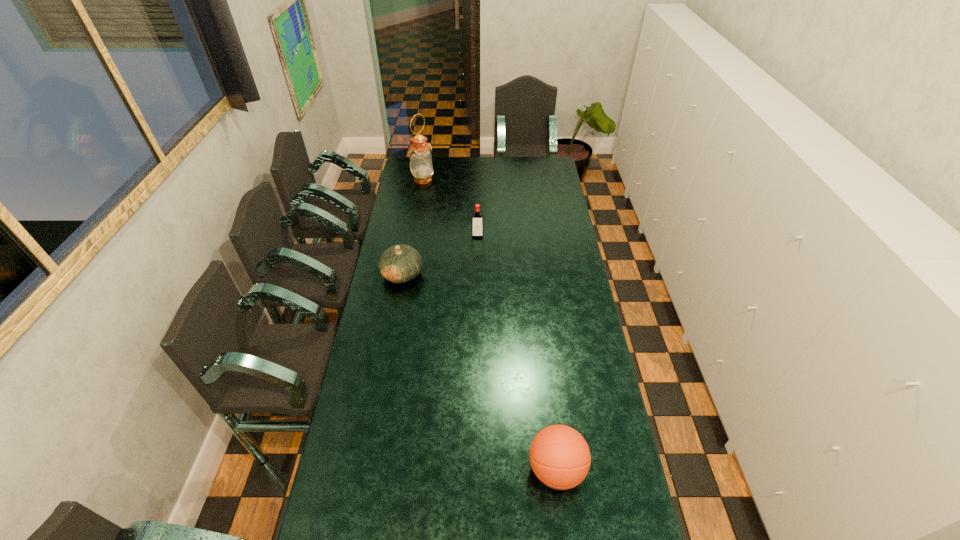
Where is `free space located 0.070m on the back of the rightmost object`? Image resolution: width=960 pixels, height=540 pixels. free space located 0.070m on the back of the rightmost object is located at coordinates (550, 421).

At what (x,y) coordinates should I click in order to perform the action: click on vacant region located on the front of the shortest object. Please return your answer as a coordinate pair (x, y). Looking at the image, I should click on (395, 319).

You are a GUI agent. You are given a task and a screenshot of the screen. Output one action in this format:
    pyautogui.click(x=<x>, y=<y>)
    Task: Click on the object located in the far edge section of the desktop
    The image size is (960, 540).
    Given the screenshot: What is the action you would take?
    pyautogui.click(x=421, y=166)

Identify the location of oil lamp at the left edge. The image size is (960, 540). (421, 166).

The image size is (960, 540). What are the coordinates of `gourd that is positioned at the left edge` in the screenshot? It's located at (400, 263).

At what (x,y) coordinates should I click in order to perform the action: click on object that is at the right edge. Please return your answer as a coordinate pair (x, y). The height and width of the screenshot is (540, 960). Looking at the image, I should click on (560, 458).

Find the location of a particular element. This screenshot has height=540, width=960. object at the far left corner is located at coordinates (421, 166).

This screenshot has height=540, width=960. In order to click on free spot at the far edge of the desktop in this screenshot , I will do `click(466, 156)`.

Find the location of a particular element. This screenshot has height=540, width=960. vacant space at the left edge is located at coordinates (408, 180).

The width and height of the screenshot is (960, 540). In the image, there is a desktop. Identify the location of vacant space at the right edge. (578, 308).